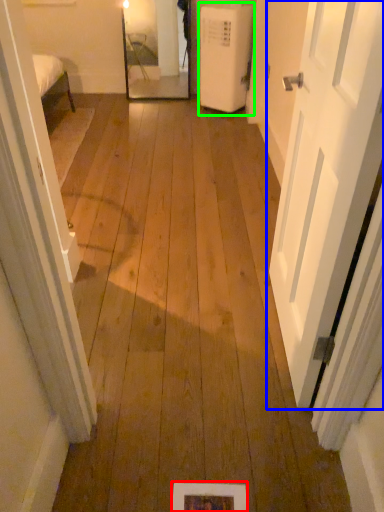
Question: Which is farther away from picture frame (highlighted by a red box)? door (highlighted by a blue box) or air conditioner (highlighted by a green box)?

Choices:
 (A) door
 (B) air conditioner

Answer: (B)